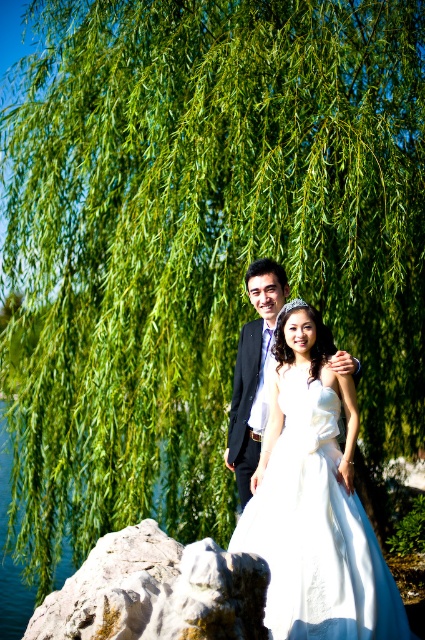
Question: Based on their relative distances, which object is nearer to the white satin dress at center?

Choices:
 (A) rough textured rock at lower left
 (B) matte black suit at center

Answer: (B)

Question: Can you confirm if white satin dress at center is wider than matte black suit at center?

Choices:
 (A) yes
 (B) no

Answer: (A)

Question: Can you confirm if white satin dress at center is thinner than matte black suit at center?

Choices:
 (A) yes
 (B) no

Answer: (B)

Question: Which of the following is the closest to the observer?

Choices:
 (A) matte black suit at center
 (B) white satin dress at center

Answer: (B)

Question: Which point is closer to the camera?

Choices:
 (A) (158, 534)
 (B) (260, 419)
 (C) (312, 596)

Answer: (C)

Question: Is rough textured rock at lower left below matte black suit at center?

Choices:
 (A) no
 (B) yes

Answer: (B)